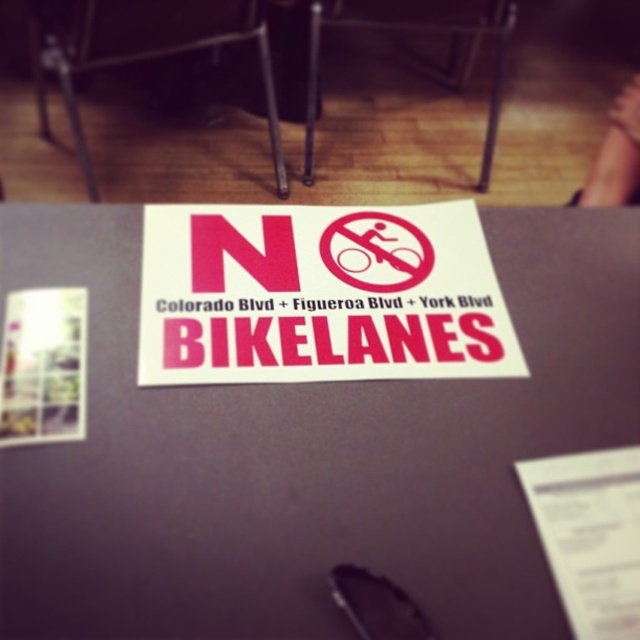
Question: Does purple matte paper at center appear on the right side of matte red sign at center?

Choices:
 (A) yes
 (B) no

Answer: (A)

Question: Which point appears farthest from the camera in this image?

Choices:
 (A) (189, 376)
 (B) (406, 572)

Answer: (A)

Question: Which point is closer to the camera?

Choices:
 (A) purple matte paper at center
 (B) matte red sign at center

Answer: (A)

Question: Which object appears farthest from the camera in this image?

Choices:
 (A) matte red sign at center
 (B) purple matte paper at center

Answer: (A)

Question: Is purple matte paper at center closer to the viewer compared to matte red sign at center?

Choices:
 (A) no
 (B) yes

Answer: (B)

Question: Is purple matte paper at center thinner than matte red sign at center?

Choices:
 (A) yes
 (B) no

Answer: (B)